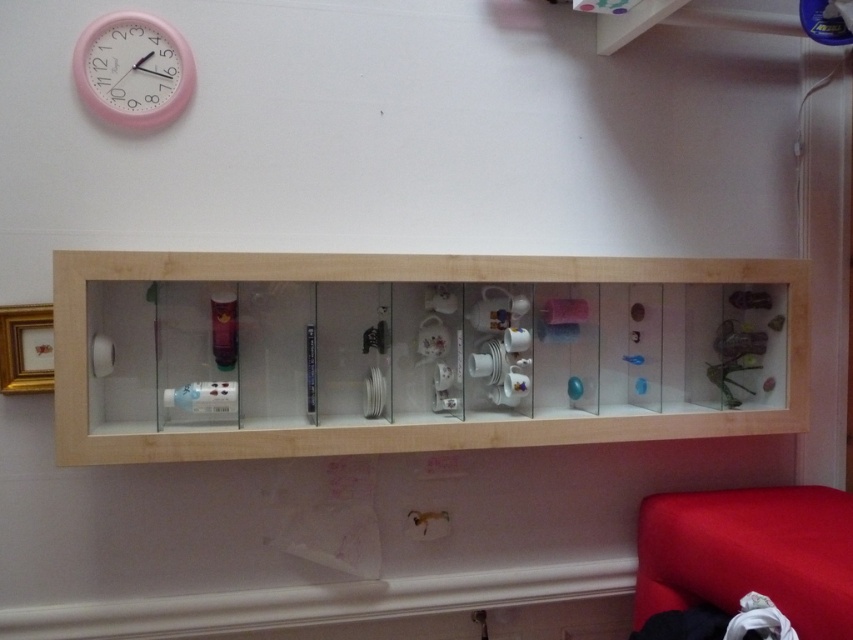
Does light wood/transparent glass medicine cabinet at center appear over pink plastic clock at upper left?

No, light wood/transparent glass medicine cabinet at center is not above pink plastic clock at upper left.

Can you confirm if light wood/transparent glass medicine cabinet at center is taller than pink plastic clock at upper left?

Yes.

Where is `light wood/transparent glass medicine cabinet at center`? light wood/transparent glass medicine cabinet at center is located at coordinates (401, 424).